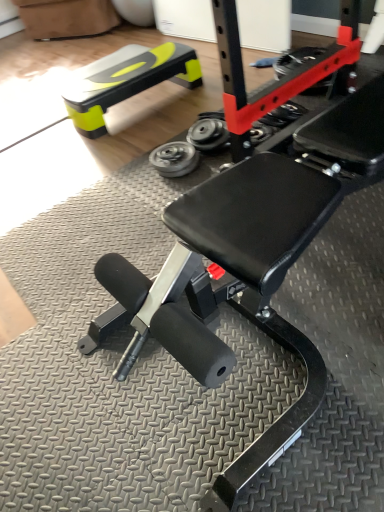
Identify the location of free location above metallic gray wheel at center, the 1th wheel positioned from the right (from a real-world perspective). This screenshot has width=384, height=512. (206, 131).